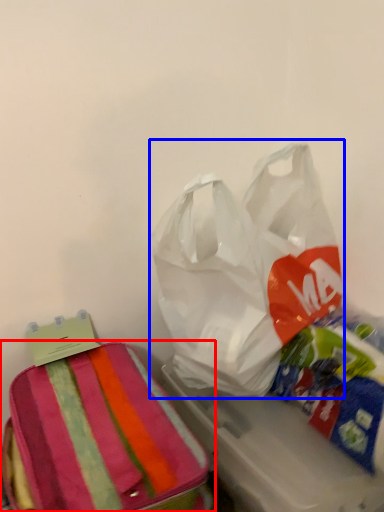
Question: Which point is further to the camera, luggage and bags (highlighted by a red box) or plastic bag (highlighted by a blue box)?

Choices:
 (A) luggage and bags
 (B) plastic bag

Answer: (B)